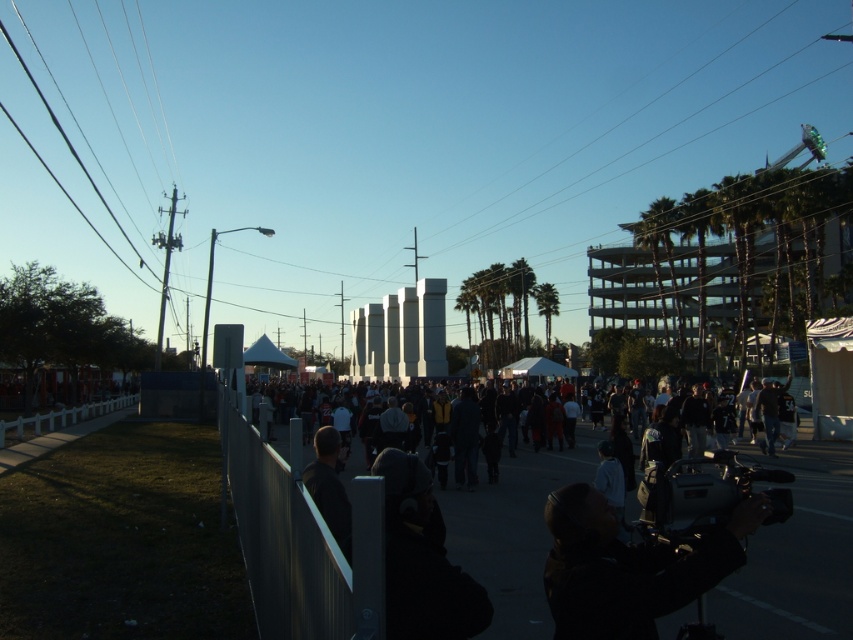
Question: Is metallic gray fence at center above white plastic fence at lower left?

Choices:
 (A) yes
 (B) no

Answer: (A)

Question: Is green leafy palm tree at upper right smaller than white plastic fence at lower left?

Choices:
 (A) no
 (B) yes

Answer: (B)

Question: Which of these objects is positioned closest to the metallic gray fence at center?

Choices:
 (A) white plastic fence at lower left
 (B) black matte camera at lower right
 (C) dark clothing at center
 (D) green leafy palm tree at upper right

Answer: (B)

Question: Which point appears closest to the camera in this image?

Choices:
 (A) (299, 483)
 (B) (703, 282)
 (C) (564, 582)
 (D) (502, 477)

Answer: (C)

Question: Which object is closer to the camera taking this photo?

Choices:
 (A) metallic gray fence at center
 (B) green leafy palm tree at upper right
 (C) dark clothing at center
 (D) black matte camera at lower right

Answer: (A)

Question: Is black matte camera at lower right thinner than green leafy palm tree at upper right?

Choices:
 (A) yes
 (B) no

Answer: (A)